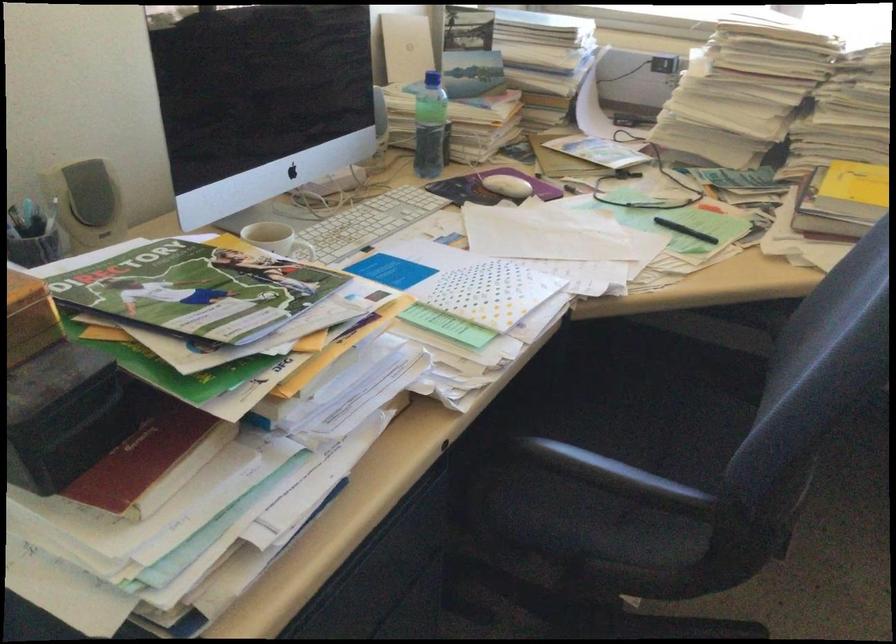
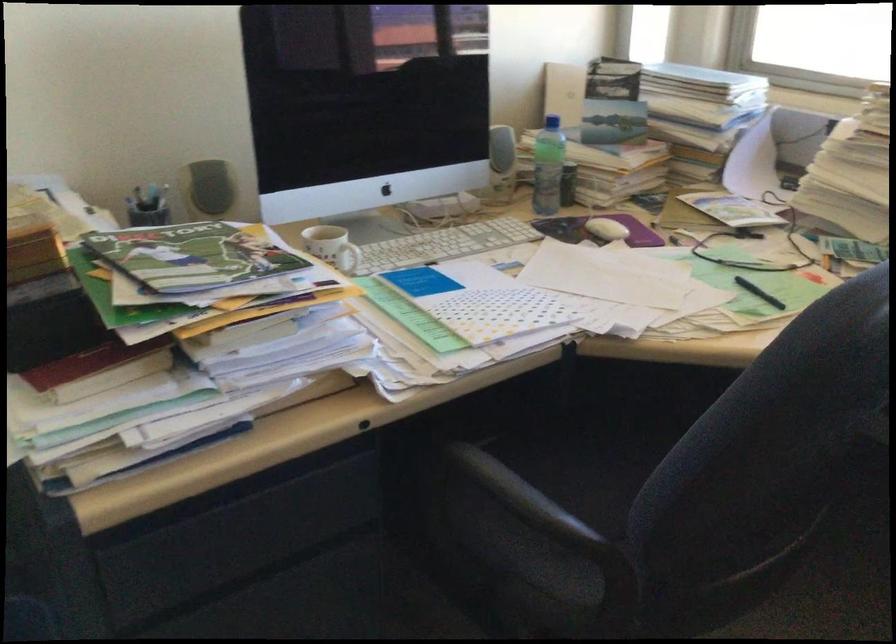
Find the pixel in the second image that matches pixel 309 257 in the first image.

(348, 258)